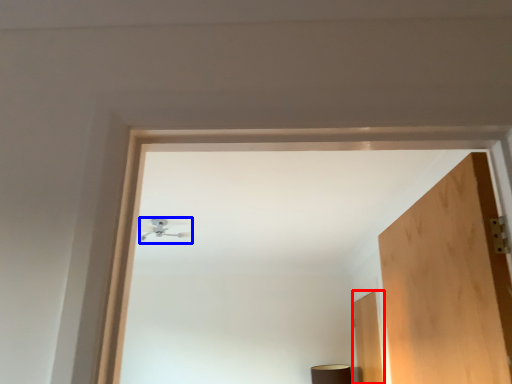
Question: Which of the following is the closest to the observer, door (highlighted by a red box) or lamp (highlighted by a blue box)?

Choices:
 (A) door
 (B) lamp

Answer: (B)